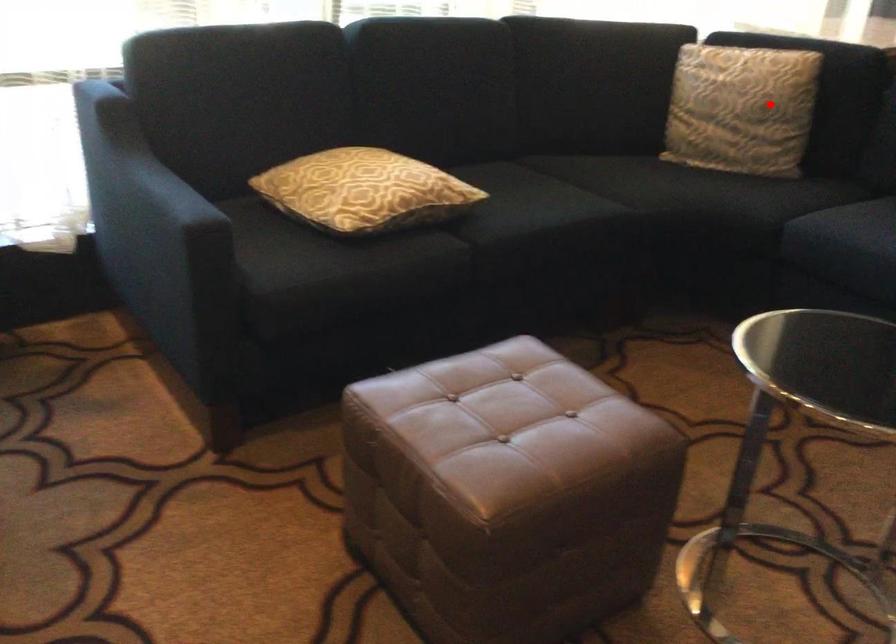
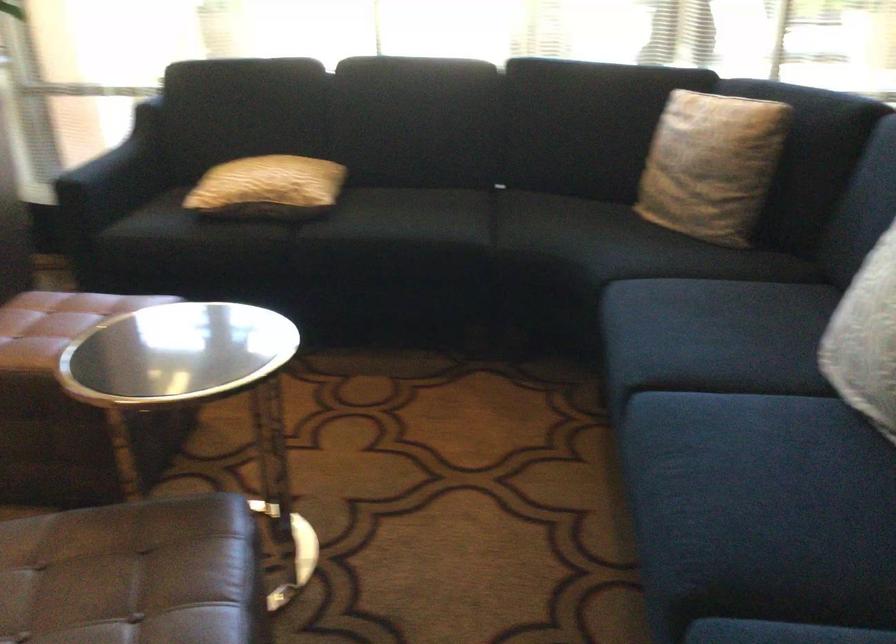
The point at the highlighted location is marked in the first image. Where is the corresponding point in the second image?

(711, 165)